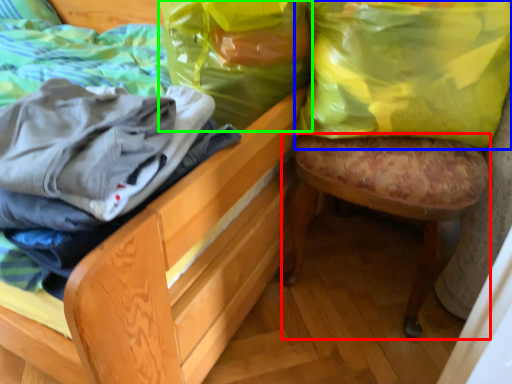
Question: Considering the real-world distances, which object is closest to stool (highlighted by a red box)? shopping bag (highlighted by a blue box) or shopping bag (highlighted by a green box).

Choices:
 (A) shopping bag
 (B) shopping bag

Answer: (A)